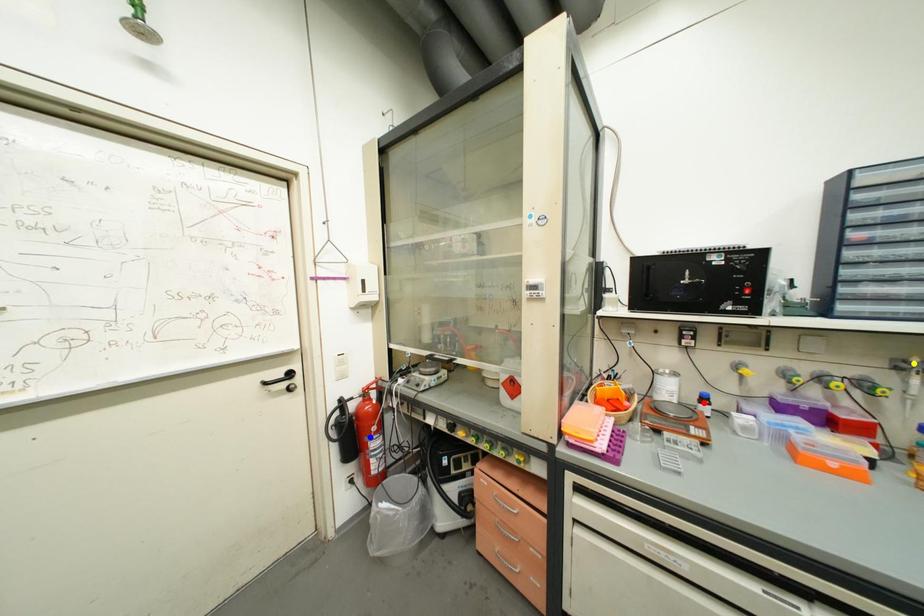
Order these from nearest to farthest:
A) yellow point
B) blue point
C) red point

yellow point < red point < blue point